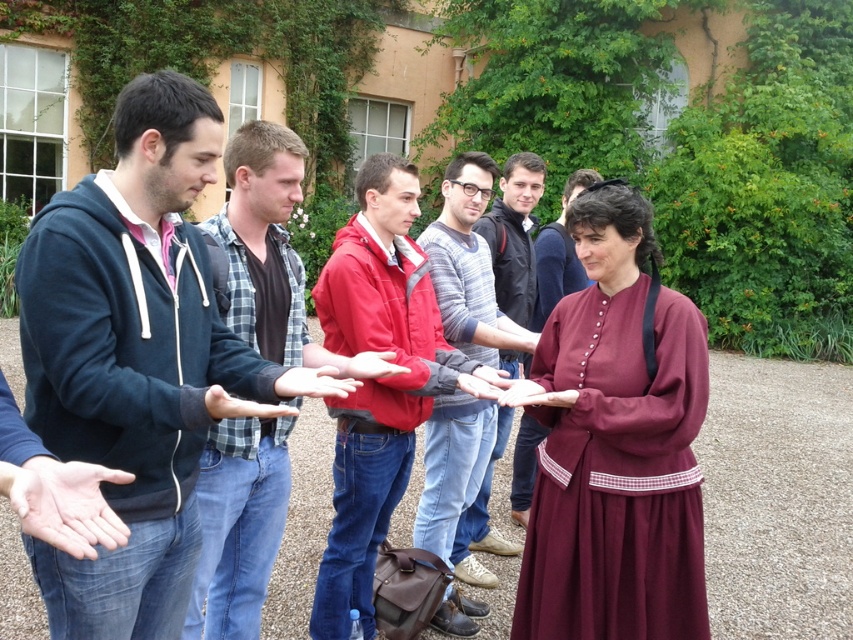
Question: Which of the following is the farthest from the observer?

Choices:
 (A) matte brown leather hand at center
 (B) matte red hand at center

Answer: (A)

Question: From the image, what is the correct spatial relationship of red jacket at center in relation to matte red hand at center?

Choices:
 (A) above
 (B) below

Answer: (B)

Question: Among these points, which one is nearest to the camera?

Choices:
 (A) (514, 384)
 (B) (416, 333)
 (C) (688, 445)
 (D) (492, 445)

Answer: (C)

Question: Which object appears farthest from the camera in this image?

Choices:
 (A) dark blue hoodie at left
 (B) red jacket at center
 (C) matte red jacket at center
 (D) smooth skin hand at center

Answer: (C)

Question: Where is red jacket at center located in relation to matte brown leather hand at center in the image?

Choices:
 (A) below
 (B) above

Answer: (A)

Question: Is pink flesh at center above matte brown leather hand at center?

Choices:
 (A) no
 (B) yes

Answer: (A)